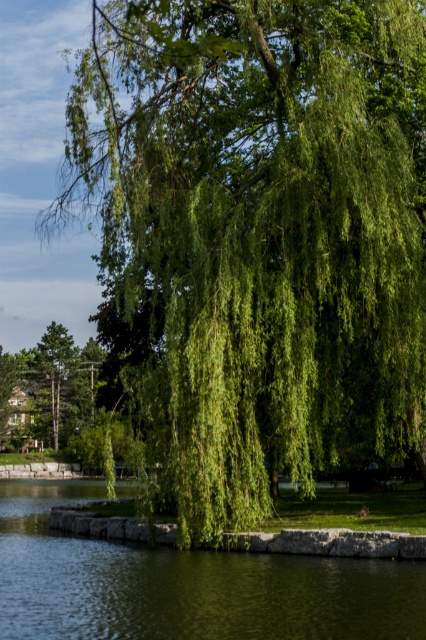
You are standing on the stone pathway and see the green liquid water at lower left and the green leafy tree at lower left. Which object is nearer to you?

The green liquid water at lower left is closer to the viewer than the green leafy tree at lower left, so the green liquid water at lower left is nearer to you.

You are a hiker who wants to cross the green liquid water at lower left. There is a green leafy tree at lower left nearby. Can you use the tree to help you cross the water?

The green liquid water at lower left is below the green leafy tree at lower left, so you could potentially use the tree to help cross the water by climbing or using its branches as a support.